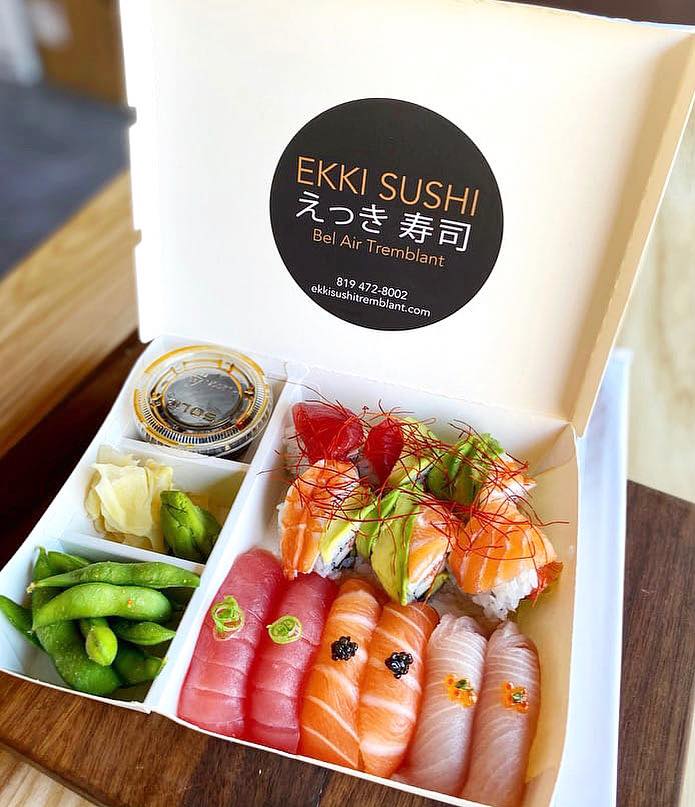
Image resolution: width=695 pixels, height=807 pixels. Find the location of `cutting board`. cutting board is located at coordinates (668, 604).